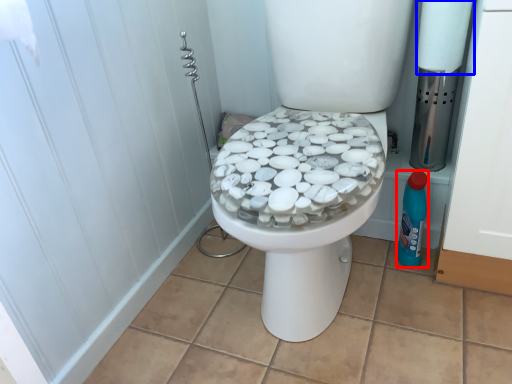
Question: Which object appears closest to the camera in this image, cleaning product (highlighted by a red box) or toilet paper (highlighted by a blue box)?

Choices:
 (A) cleaning product
 (B) toilet paper

Answer: (B)